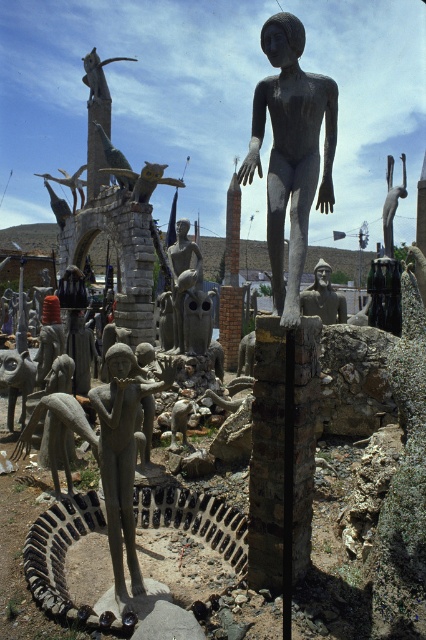
Question: Is bronze statue at center positioned at the back of matte bronze statue at center?

Choices:
 (A) yes
 (B) no

Answer: (B)

Question: Does bronze statue at center come in front of matte bronze statue at center?

Choices:
 (A) yes
 (B) no

Answer: (A)

Question: Can you confirm if bronze statue at center is positioned to the right of matte bronze statue at center?

Choices:
 (A) yes
 (B) no

Answer: (B)

Question: Which point appears farthest from the camera in this image?

Choices:
 (A) (336, 298)
 (B) (250, 170)

Answer: (A)